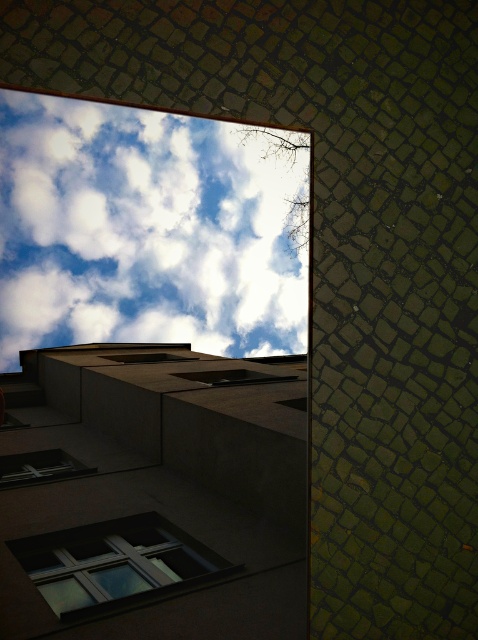
Is transparent glass window at lower left shorter than matte glass window at lower left?

In fact, transparent glass window at lower left may be taller than matte glass window at lower left.

Can you confirm if transparent glass window at lower left is taller than matte glass window at lower left?

Indeed, transparent glass window at lower left has a greater height compared to matte glass window at lower left.

I want to click on transparent glass window at lower left, so click(x=113, y=563).

Between point (188, 273) and point (22, 540), which one is positioned behind?

The point (22, 540) is more distant.

How far apart are white fluffy cloud at upper center and transparent glass window at lower left?

white fluffy cloud at upper center and transparent glass window at lower left are 1.18 meters apart.

The image size is (478, 640). I want to click on white fluffy cloud at upper center, so click(148, 230).

Is point (111, 256) farther from camera compared to point (54, 476)?

No, (111, 256) is closer to viewer.

Between point (273, 156) and point (45, 480), which one is positioned in front?

Point (273, 156)

In order to click on white fluffy cloud at upper center in this screenshot , I will do `click(148, 230)`.